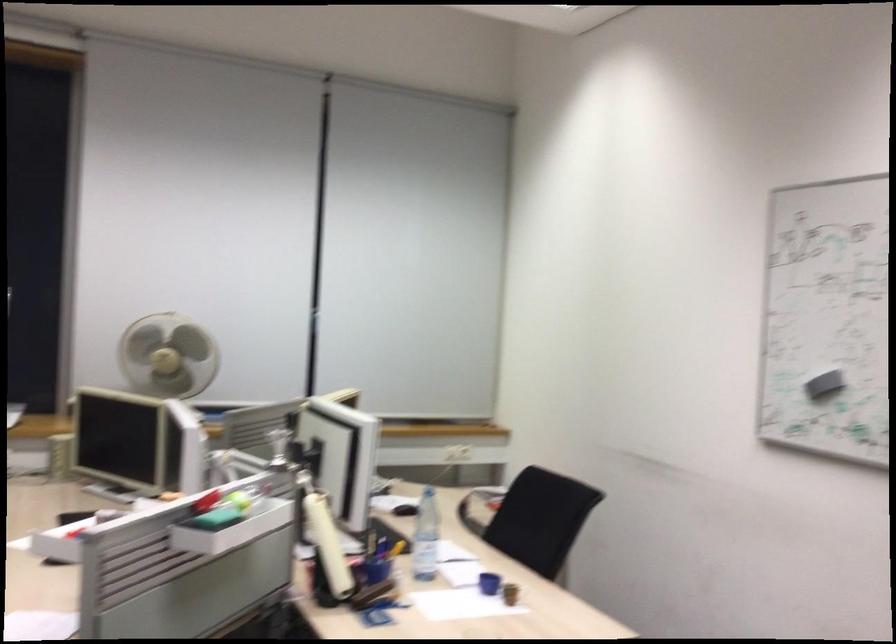
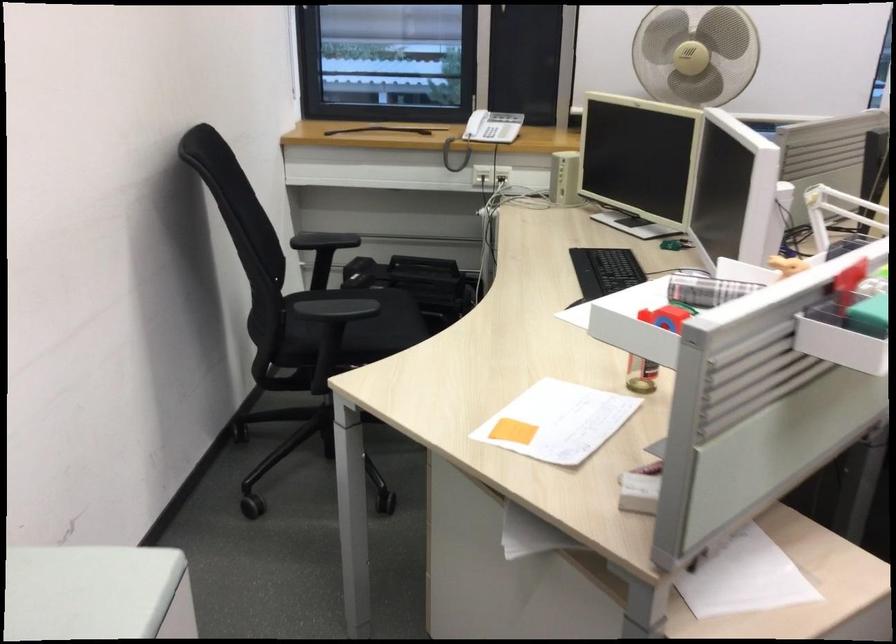
Based on the continuous images, in which direction is the camera rotating?

The rotation direction of the camera is left-down.